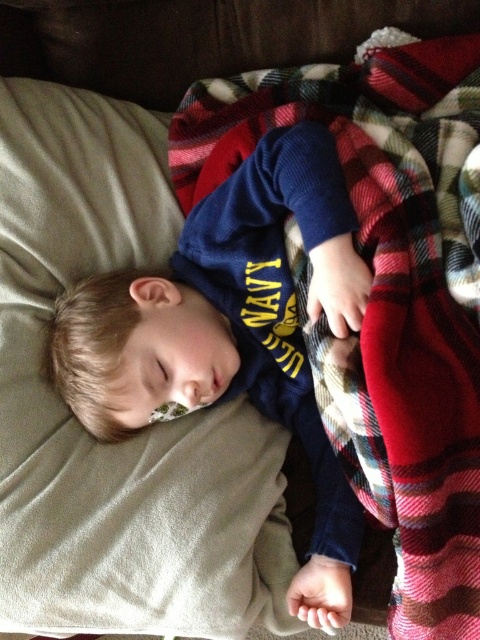
Looking at this image, you are trying to decide which item to use to cover the sleeping child more comfortably. The plaid fabric blanket at upper right and the navy blue sweater at center are both available. Which item is wider and thus better suited for covering the child?

The plaid fabric blanket at upper right might be wider than the navy blue sweater at center, so it is better suited for covering the child.

You are a photographer trying to capture a closeup shot of the child sleeping on the couch. You need to adjust your camera to focus on the point at coordinates point (204, 104). What is the minimum distance you should set your camera lens to focus at to ensure the point is in sharp focus?

The point (204, 104) is 37.48 inches away from the camera, so you should set the camera lens to focus at least 37.48 inches away to ensure the point is in sharp focus.

You are a parent checking on your child. You see the plaid fabric blanket at upper right and the navy blue sweater at center. Which item is closer to you?

The plaid fabric blanket at upper right is closer to you because it is in front of the navy blue sweater at center.